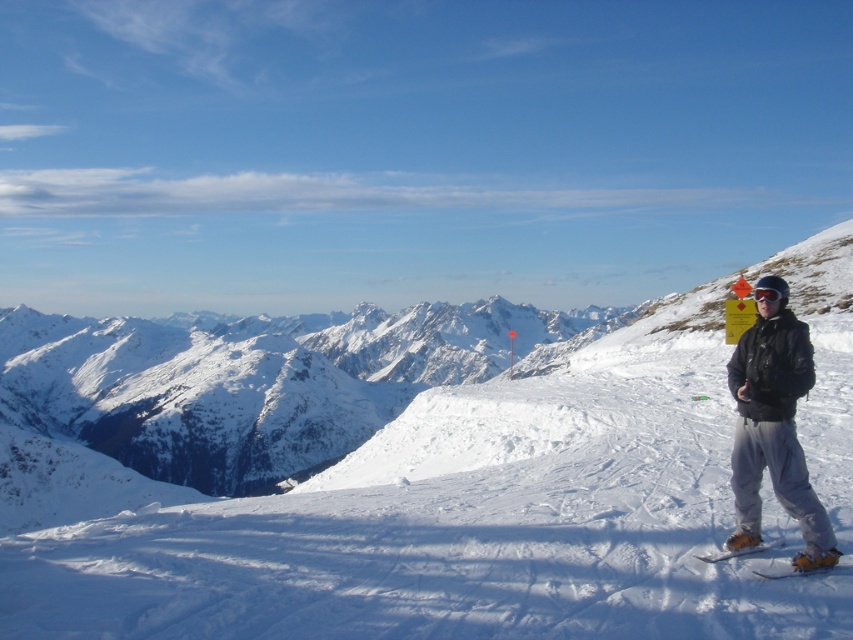
From the picture: You are a skier planning to navigate from the orange flag to the ski resort base. You notice two points marked on your map. Which point, point (706, 557) or point (780, 296), is closer to your current location near the orange flag?

Point (706, 557) is closer to the viewer than point (780, 296), so the closer point to your current location near the orange flag is point (706, 557).

You are a skier looking for your equipment. You remember leaving your yellow matte snowboard somewhere on the slope. According to the image, where exactly is the yellow matte snowboard at lower right located?

The yellow matte snowboard at lower right is located at point coordinates of (805, 564).